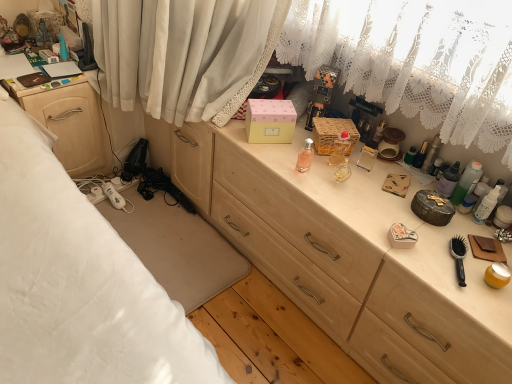
Question: From the image's perspective, does translucent glass perfume at center, acting as the second toiletry starting from the left, appear lower than pink matte box at center?

Choices:
 (A) no
 (B) yes

Answer: (B)

Question: From a real-world perspective, is translucent glass perfume at center, acting as the second toiletry starting from the left, over pink matte box at center?

Choices:
 (A) yes
 (B) no

Answer: (A)

Question: Does translucent glass perfume at center, acting as the second toiletry starting from the left, have a larger size compared to pink matte box at center?

Choices:
 (A) yes
 (B) no

Answer: (B)

Question: Does translucent glass perfume at center, acting as the 4th toiletry starting from the right, have a smaller size compared to pink matte box at center?

Choices:
 (A) no
 (B) yes

Answer: (B)

Question: Does translucent glass perfume at center, acting as the 4th toiletry starting from the right, have a greater height compared to pink matte box at center?

Choices:
 (A) yes
 (B) no

Answer: (B)

Question: From the image's perspective, is translucent glass perfume at center, acting as the 4th toiletry starting from the right, located above pink matte box at center?

Choices:
 (A) no
 (B) yes

Answer: (A)

Question: Is woven brown picnic basket at center surrounded by translucent plastic bottles at right, the second toiletry when ordered from right to left?

Choices:
 (A) yes
 (B) no

Answer: (B)

Question: From a real-world perspective, is translucent plastic bottles at right, the second toiletry when ordered from right to left, positioned under woven brown picnic basket at center based on gravity?

Choices:
 (A) yes
 (B) no

Answer: (B)

Question: Is translucent plastic bottles at right, the second toiletry when ordered from right to left, not within woven brown picnic basket at center?

Choices:
 (A) yes
 (B) no

Answer: (A)

Question: Is translucent plastic bottles at right, the second toiletry when ordered from right to left, thinner than woven brown picnic basket at center?

Choices:
 (A) no
 (B) yes

Answer: (B)

Question: Can you confirm if translucent plastic bottles at right, the second toiletry when ordered from right to left, is wider than woven brown picnic basket at center?

Choices:
 (A) no
 (B) yes

Answer: (A)

Question: Is translucent plastic bottles at right, the second toiletry when ordered from right to left, to the right of woven brown picnic basket at center from the viewer's perspective?

Choices:
 (A) yes
 (B) no

Answer: (A)

Question: Is pink matte box at center a part of translucent plastic bottles at right, the second toiletry when ordered from right to left?

Choices:
 (A) no
 (B) yes

Answer: (A)